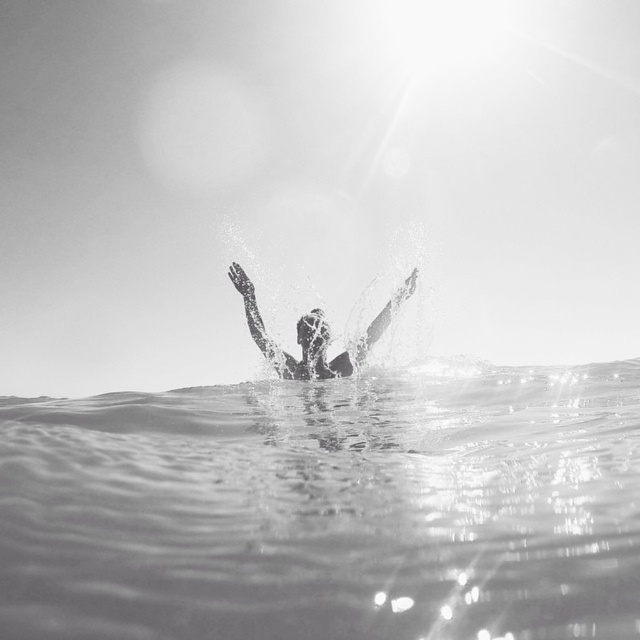
Question: Where is clear water at center located in relation to silhouette smooth skin at center in the image?

Choices:
 (A) right
 (B) left

Answer: (A)

Question: Among these objects, which one is farthest from the camera?

Choices:
 (A) clear water at center
 (B) silhouette smooth skin at center

Answer: (B)

Question: Which point is farther to the camera?

Choices:
 (A) silhouette smooth skin at center
 (B) clear water at center

Answer: (A)

Question: Where is clear water at center located in relation to silhouette smooth skin at center in the image?

Choices:
 (A) left
 (B) right

Answer: (B)

Question: In this image, where is clear water at center located relative to silhouette smooth skin at center?

Choices:
 (A) left
 (B) right

Answer: (B)